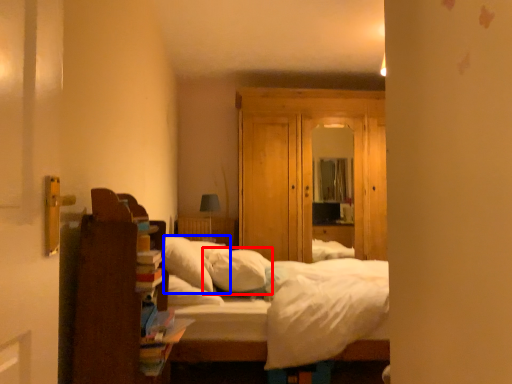
Question: Among these objects, which one is farthest to the camera, pillow (highlighted by a red box) or pillow (highlighted by a blue box)?

Choices:
 (A) pillow
 (B) pillow

Answer: (A)